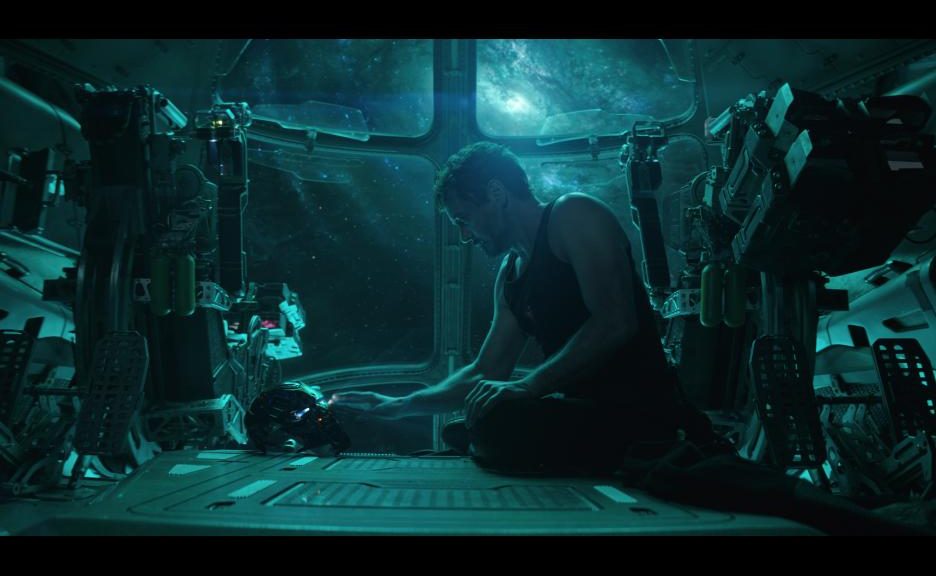
Find the location of `frame`. frame is located at coordinates (448, 282).